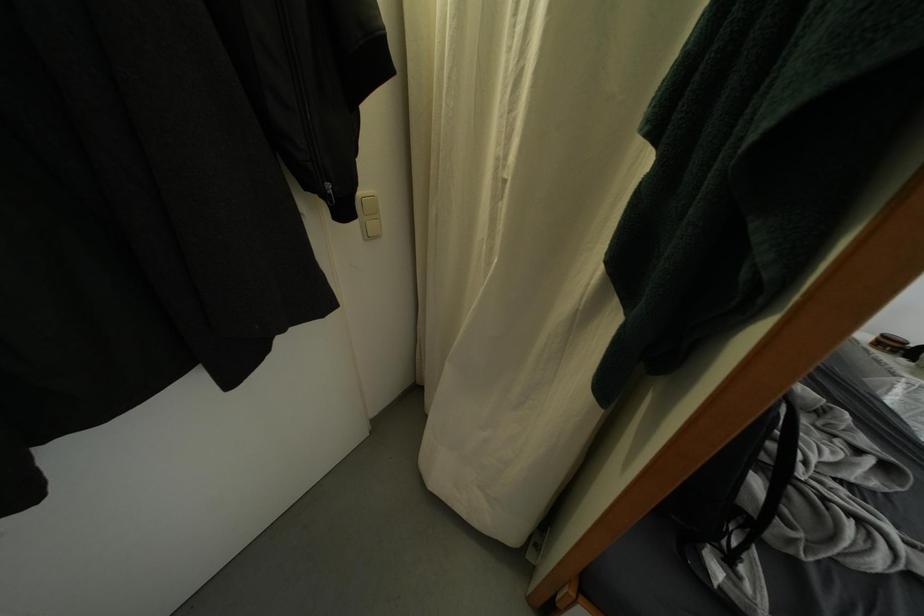
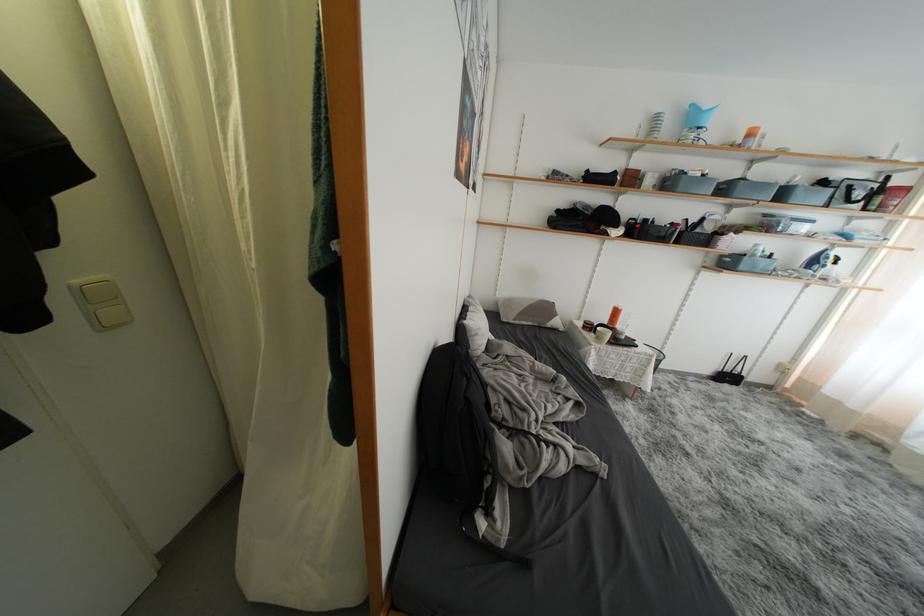
In a continuous first-person perspective shot, in which direction is the camera moving?

The movement direction of the cameraman is right, backward.